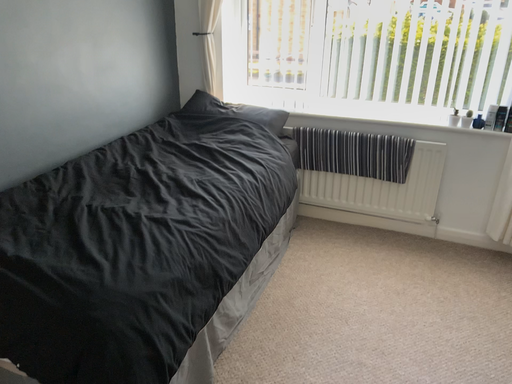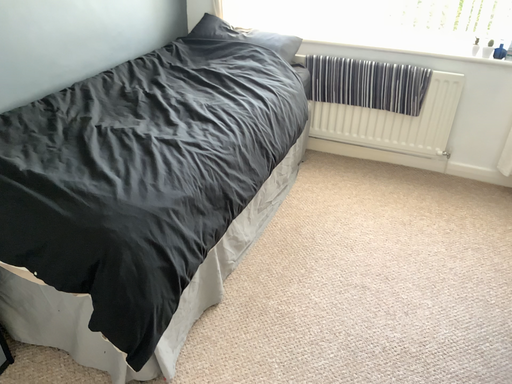
Question: Which way did the camera rotate in the video?

Choices:
 (A) rotated upward
 (B) rotated downward

Answer: (B)